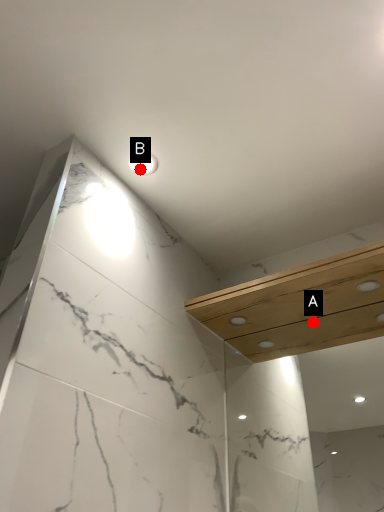
Question: Two points are circled on the image, labeled by A and B beside each circle. Which of the following is the farthest from the observer?

Choices:
 (A) A is further
 (B) B is further

Answer: (A)